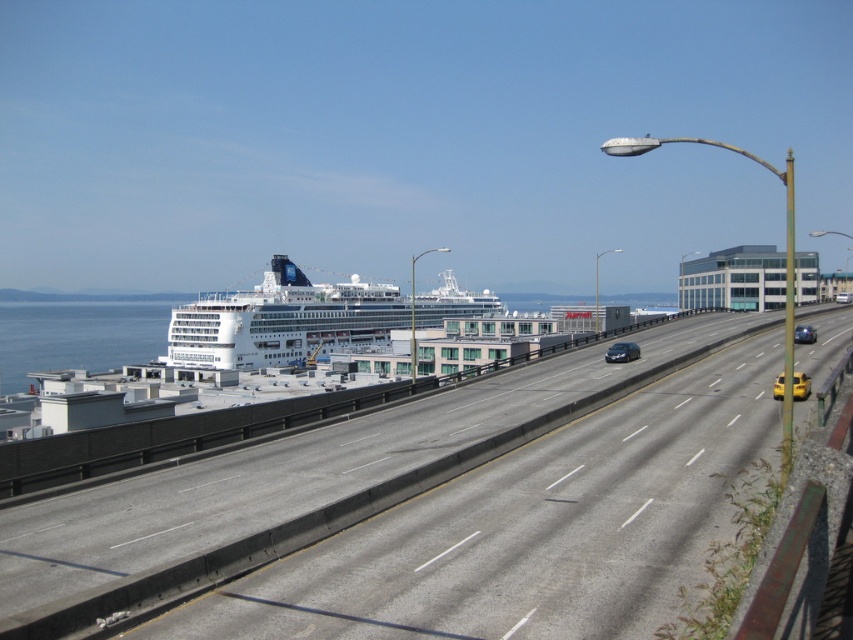
Does gray asphalt highway at center have a greater width compared to yellow matte taxi cab at center-right?

Correct, the width of gray asphalt highway at center exceeds that of yellow matte taxi cab at center-right.

The width and height of the screenshot is (853, 640). What do you see at coordinates (306, 481) in the screenshot?
I see `gray asphalt highway at center` at bounding box center [306, 481].

Between point (96, 563) and point (807, 380), which one is positioned in front?

Positioned in front is point (96, 563).

Image resolution: width=853 pixels, height=640 pixels. I want to click on gray asphalt highway at center, so click(306, 481).

Which is above, white glossy cruise ship at center or yellow matte taxi cab at center-right?

white glossy cruise ship at center is higher up.

Is white glossy cruise ship at center taller than yellow matte taxi cab at center-right?

Indeed, white glossy cruise ship at center has a greater height compared to yellow matte taxi cab at center-right.

Is point (224, 362) in front of point (772, 388)?

That is False.

Where is `white glossy cruise ship at center`? The image size is (853, 640). white glossy cruise ship at center is located at coordinates (283, 321).

Can you confirm if gray asphalt highway at center is wider than yellow matte taxi at right?

Answer: Indeed, gray asphalt highway at center has a greater width compared to yellow matte taxi at right.

Which is in front, point (596, 397) or point (796, 337)?

Point (596, 397) is in front.

Identify the location of gray asphalt highway at center. 306,481.